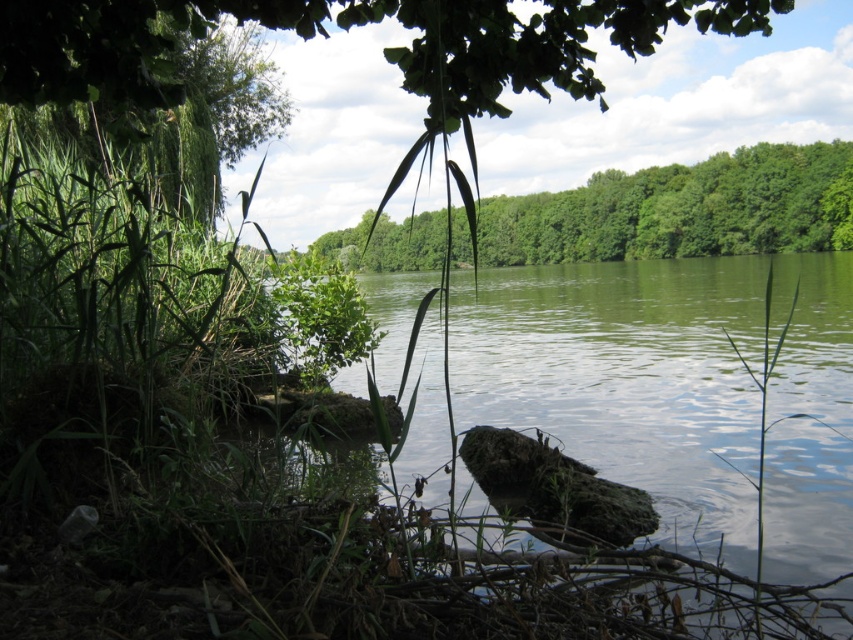
Between green mossy rock at center and green leafy tree at center, which one appears on the left side from the viewer's perspective?

green mossy rock at center is more to the left.

From the picture: Does green mossy rock at center have a smaller size compared to green leafy tree at center?

Yes.

Does point (556, 342) come farther from viewer compared to point (811, 218)?

That is False.

Find the location of `green mossy rock at center`. green mossy rock at center is located at coordinates (679, 392).